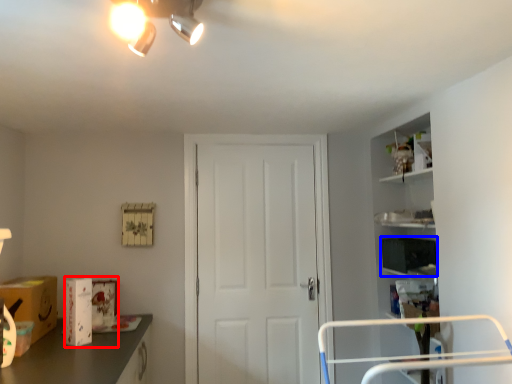
Question: Among these objects, which one is farthest to the camera, box (highlighted by a red box) or box (highlighted by a blue box)?

Choices:
 (A) box
 (B) box

Answer: (B)